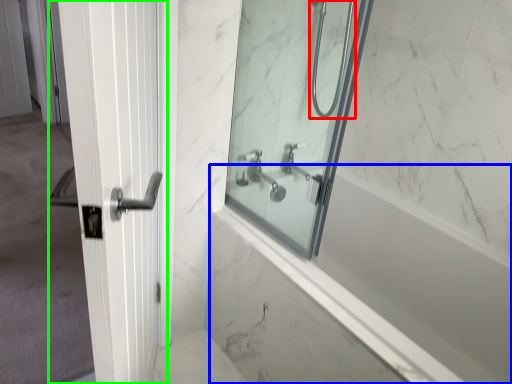
Question: Which object is positioned farthest from shower (highlighted by a red box)? Select from bath (highlighted by a blue box) and door (highlighted by a green box).

Choices:
 (A) bath
 (B) door

Answer: (B)